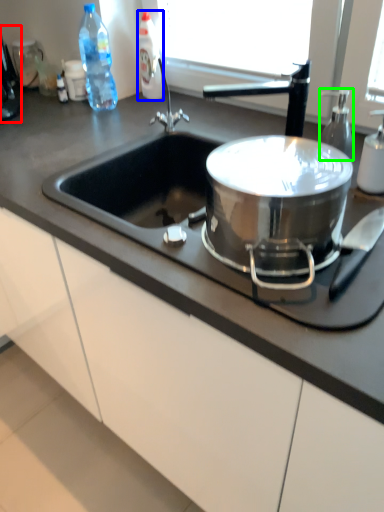
Question: Which object is positioned closest to coffee machine (highlighted by a red box)? Select from bottle (highlighted by a blue box) and soap dispenser (highlighted by a green box).

Choices:
 (A) bottle
 (B) soap dispenser

Answer: (A)